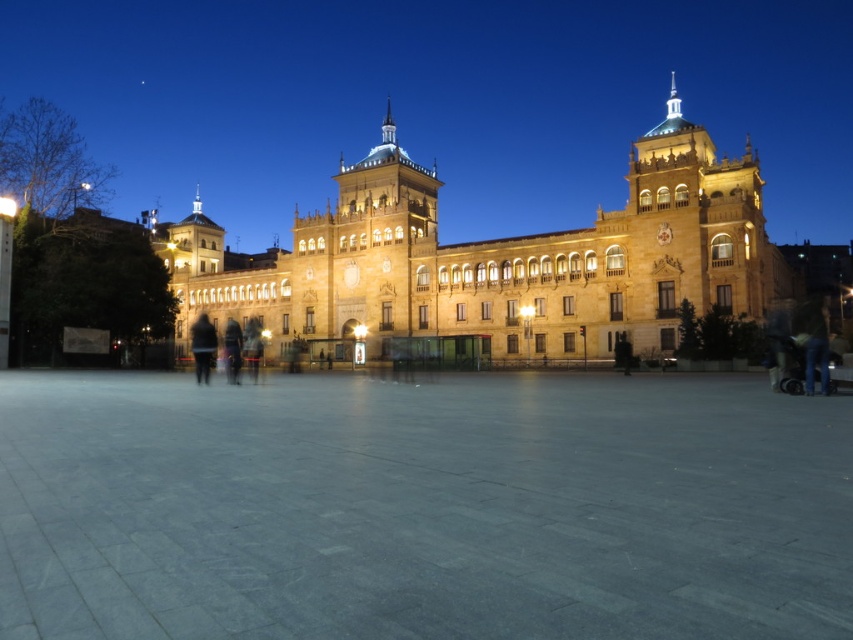
Question: Does golden stone palace at center come in front of black matte jacket at center?

Choices:
 (A) no
 (B) yes

Answer: (B)

Question: Does gray stone pavement at center appear on the right side of black matte jacket at center?

Choices:
 (A) no
 (B) yes

Answer: (B)

Question: Does gray stone pavement at center appear on the left side of golden stone palace at center?

Choices:
 (A) no
 (B) yes

Answer: (B)

Question: Estimate the real-world distances between objects in this image. Which object is farther from the dark fabric person at center?

Choices:
 (A) black matte jacket at center
 (B) gray stone pavement at center
 (C) golden stone palace at center

Answer: (B)

Question: Which of the following is the farthest from the observer?

Choices:
 (A) black matte jacket at center
 (B) golden stone palace at center
 (C) gray stone pavement at center
 (D) dark fabric person at center

Answer: (D)

Question: Which point is closer to the camera?

Choices:
 (A) gray stone pavement at center
 (B) black matte jacket at center

Answer: (A)